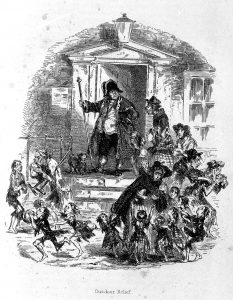
Identify the location of window. The image size is (233, 300). (199, 96).